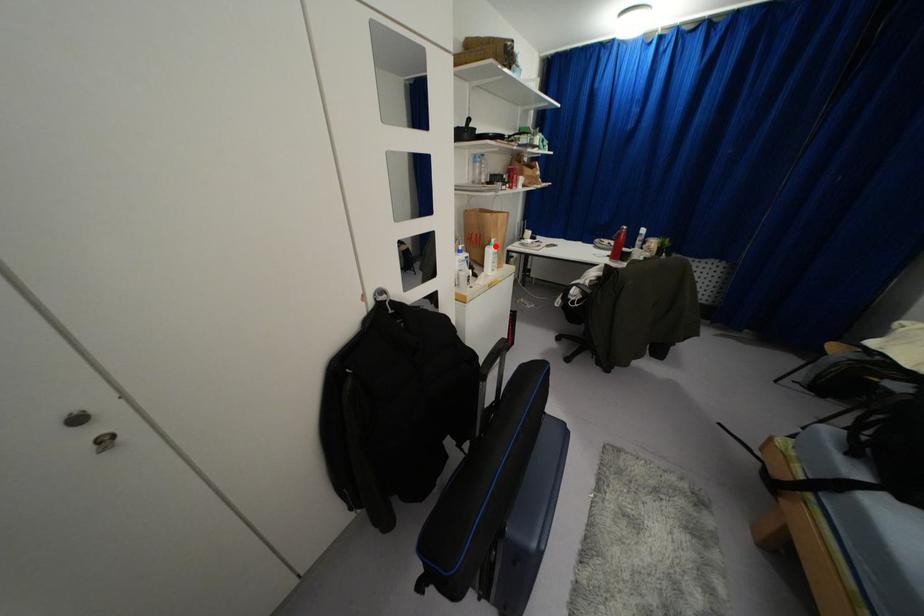
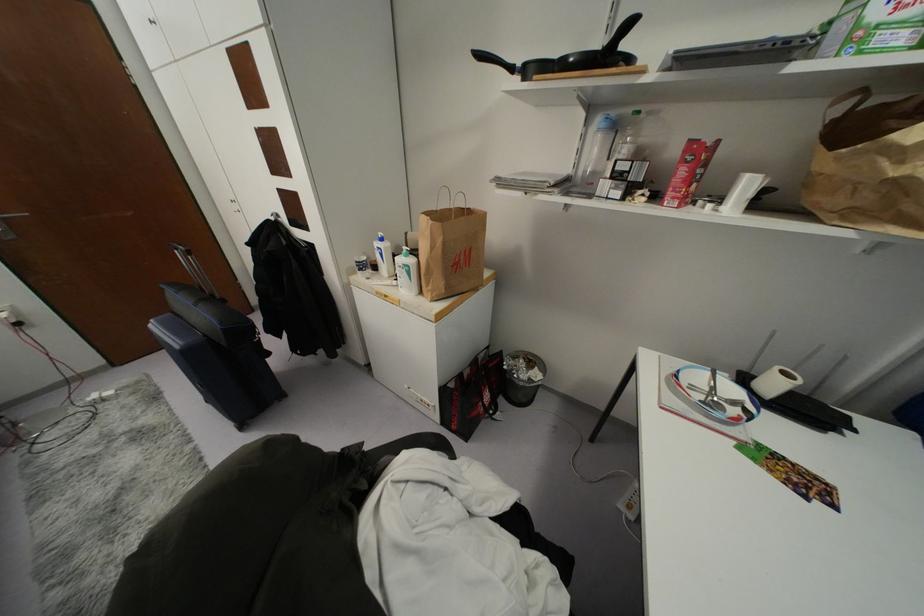
Where in the second image is the point corresponding to the highlighted location from the first image?

(410, 261)